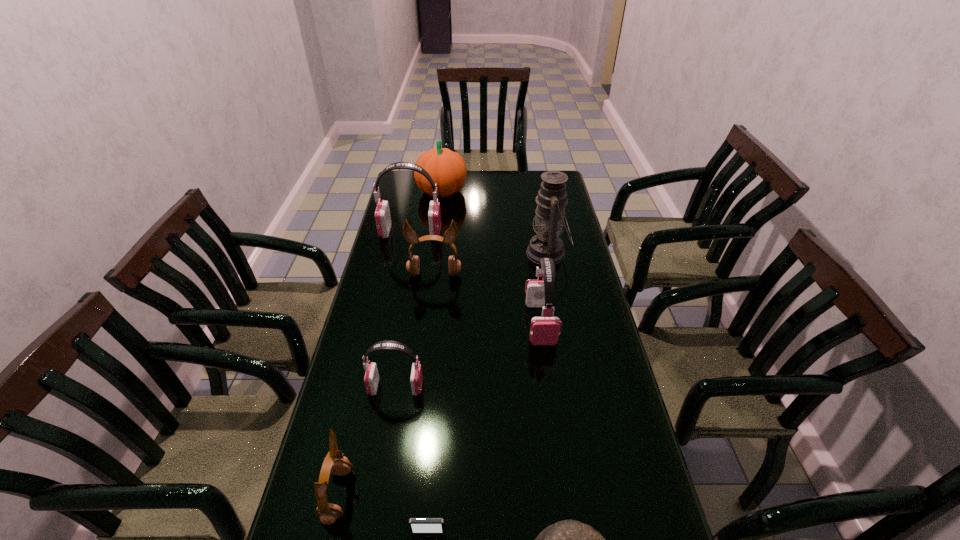
You are a GUI agent. You are given a task and a screenshot of the screen. Output one action in this format:
    pyautogui.click(x=<x>, y=<y>)
    Task: Click on the oil lamp
    The image size is (960, 540).
    Given the screenshot: What is the action you would take?
    pyautogui.click(x=552, y=197)

The width and height of the screenshot is (960, 540). Find the location of `the farthest earphone`. the farthest earphone is located at coordinates (382, 214).

You are a GUI agent. You are given a task and a screenshot of the screen. Output one action in this format:
    pyautogui.click(x=<x>, y=<y>)
    Task: Click on the biggest pink earphone
    The image size is (960, 540).
    Given the screenshot: What is the action you would take?
    pyautogui.click(x=382, y=214)

Locate an element on the screen. Image resolution: width=960 pixels, height=540 pixels. the farthest object is located at coordinates pos(447,168).

This screenshot has height=540, width=960. I want to click on orange pumpkin, so click(447, 168).

Where is `the bigger brown earphone`? The height and width of the screenshot is (540, 960). the bigger brown earphone is located at coordinates (413, 264).

What are the coordinates of `the right brown earphone` in the screenshot? It's located at (413, 264).

Where is `the second farthest pink earphone`? the second farthest pink earphone is located at coordinates [545, 330].

Locate an element on the screen. This screenshot has width=960, height=540. the second biggest pink earphone is located at coordinates (545, 330).

The image size is (960, 540). Identify the location of the smaller brown earphone. (328, 513).